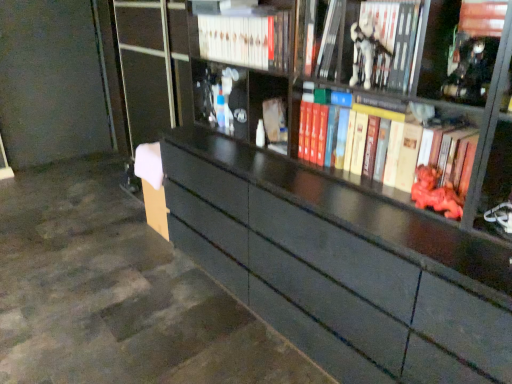
Find the location of a particular element. free location above red matte book at upper right, the fourth book from the left (from a real-world perspective) is located at coordinates (402, 115).